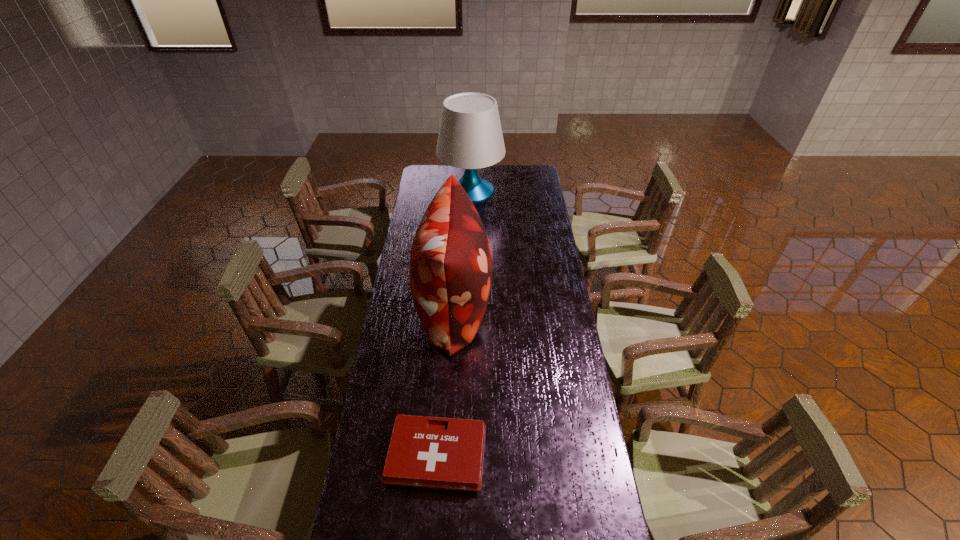
Select which object appears as the closest to the nearest object. Please provide its 2D coordinates. Your answer should be formatted as a tuple, i.e. [(x, y)], where the tuple contains the x and y coordinates of a point satisfying the conditions above.

[(450, 269)]

Where is `free spot that satisfies the following two spatial constraints: 1. on the front-facing side of the table lamp; 2. on the front side of the first-aid kit`? free spot that satisfies the following two spatial constraints: 1. on the front-facing side of the table lamp; 2. on the front side of the first-aid kit is located at coordinates (465, 455).